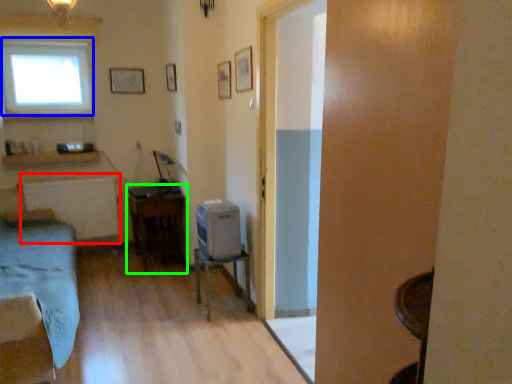
Question: Which object is positioned farthest from radiator (highlighted by a red box)? Select from window (highlighted by a blue box) and table (highlighted by a green box).

Choices:
 (A) window
 (B) table

Answer: (A)